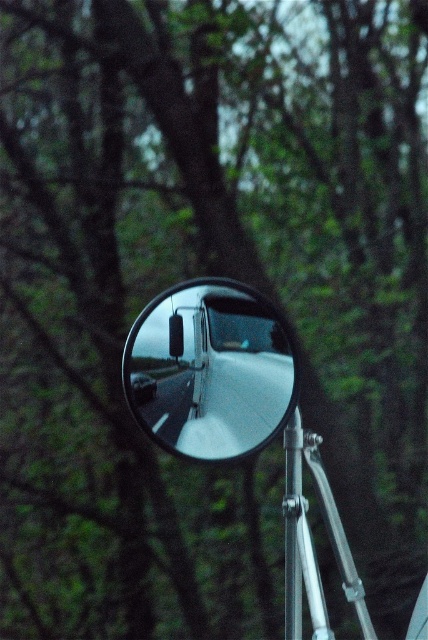
You are a photographer standing 5 feet away from the clear glass mirror at center. You want to take a photo of the reflection in the mirror. Is your current distance sufficient to capture the entire reflection?

The clear glass mirror at center and camera are 4.78 feet apart from each other. Since you are standing 5 feet away, which is slightly farther than the required distance, you might need to move closer to ensure the entire reflection is captured.